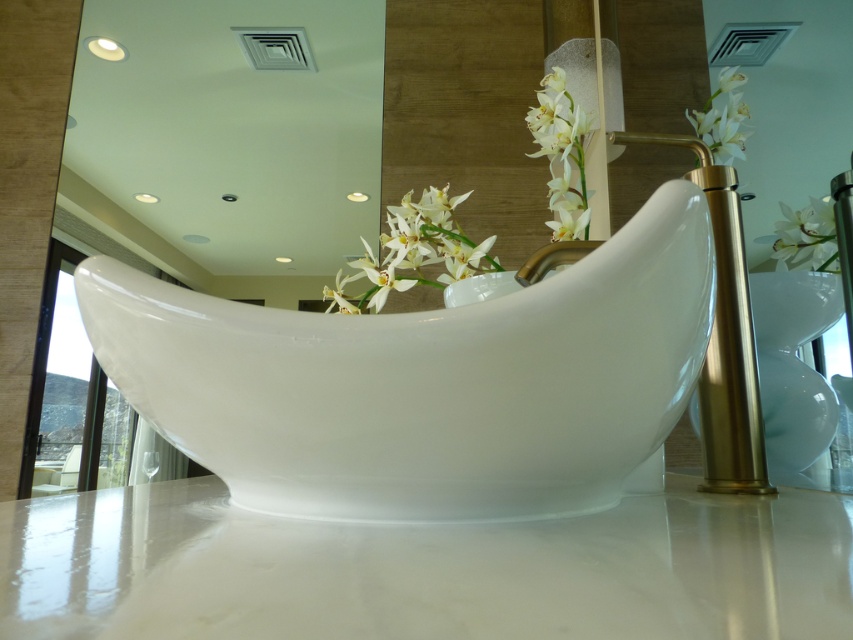
Question: Does white marble countertop at center appear on the right side of white glossy orchid at upper right?

Choices:
 (A) no
 (B) yes

Answer: (A)

Question: Which point is closer to the camera?

Choices:
 (A) white glossy flower at upper right
 (B) white porcelain flower at upper right
 (C) white glossy orchid at upper right
 (D) white marble countertop at center

Answer: (D)

Question: Which object appears closest to the camera in this image?

Choices:
 (A) white porcelain flower at upper right
 (B) white marble countertop at center

Answer: (B)

Question: Observing the image, what is the correct spatial positioning of white glossy bathtub at center in reference to white porcelain flowers at upper center?

Choices:
 (A) below
 (B) above

Answer: (A)

Question: In this image, where is white marble countertop at center located relative to white glossy flower at upper right?

Choices:
 (A) right
 (B) left

Answer: (B)

Question: Considering the real-world distances, which object is farthest from the white porcelain flowers at upper center?

Choices:
 (A) white glossy bathtub at center
 (B) white glossy flower at upper right
 (C) white marble countertop at center
 (D) white glossy orchid at upper right

Answer: (B)